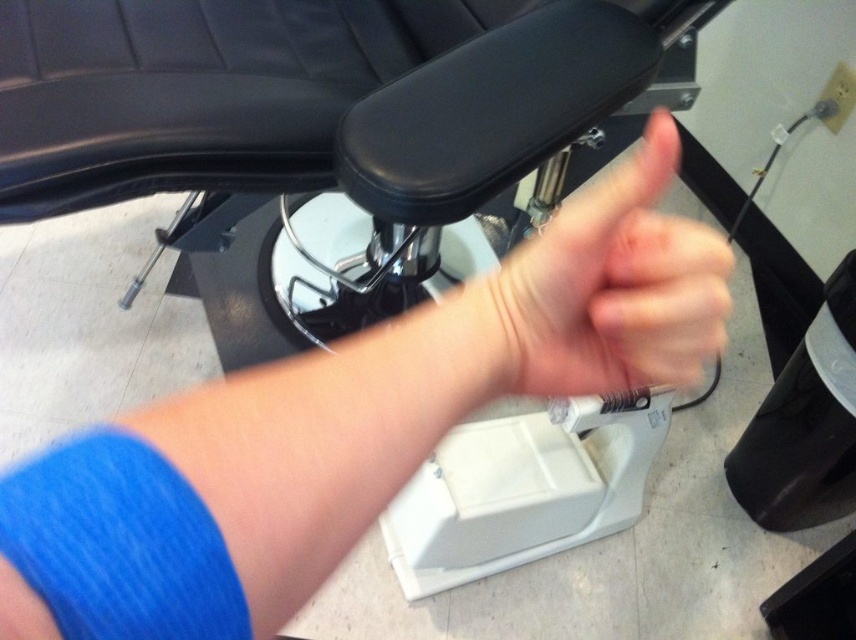
Question: Which of the following is the farthest from the observer?

Choices:
 (A) (728, 256)
 (B) (137, 412)

Answer: (B)

Question: Does blue fabric arm at center appear under skinny white hand at center?

Choices:
 (A) yes
 (B) no

Answer: (A)

Question: Can you confirm if blue fabric arm at center is positioned to the right of skinny white hand at center?

Choices:
 (A) no
 (B) yes

Answer: (A)

Question: Among these points, which one is farthest from the camera?

Choices:
 (A) (100, 468)
 (B) (622, 298)

Answer: (B)

Question: Is blue fabric arm at center positioned before skinny white hand at center?

Choices:
 (A) yes
 (B) no

Answer: (A)